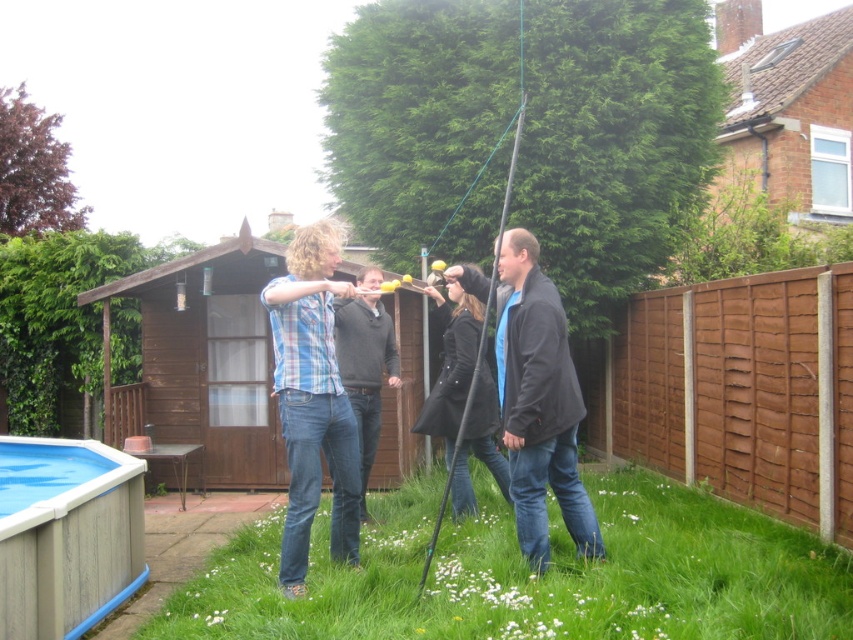
Question: Does blue plaid shirt at center come in front of blue plastic pool at lower left?

Choices:
 (A) no
 (B) yes

Answer: (B)

Question: Which of the following is the closest to the observer?

Choices:
 (A) blue plaid shirt at center
 (B) black leather jacket at center
 (C) green grass at lower center

Answer: (C)

Question: Observing the image, what is the correct spatial positioning of green grass at lower center in reference to blue denim jeans at center?

Choices:
 (A) left
 (B) right

Answer: (A)

Question: Which point is closer to the camera taking this photo?

Choices:
 (A) (486, 422)
 (B) (561, 417)

Answer: (B)

Question: Is brown wooden fence at right to the right of blue plastic pool at lower left from the viewer's perspective?

Choices:
 (A) no
 (B) yes

Answer: (B)

Question: Which object appears farthest from the camera in this image?

Choices:
 (A) blue plastic pool at lower left
 (B) blue denim jeans at center
 (C) blue plaid shirt at center
 (D) matte blue jeans at center

Answer: (D)